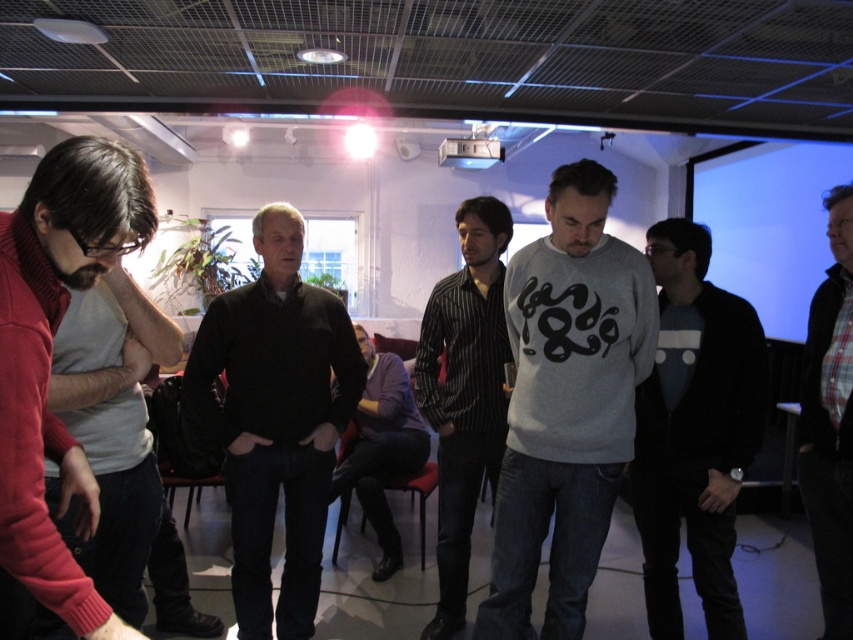
This screenshot has height=640, width=853. Describe the element at coordinates (274, 419) in the screenshot. I see `black matte sweater at center` at that location.

Does black matte sweater at center have a lesser height compared to black striped shirt at center?

Yes.

Is point (311, 496) less distant than point (444, 467)?

That is True.

The width and height of the screenshot is (853, 640). In order to click on black matte sweater at center in this screenshot , I will do pyautogui.click(x=274, y=419).

Is black matte sweater at center smaller than plaid fabric shirt at center?

No.

Is point (212, 342) farther from camera compared to point (802, 477)?

Yes, point (212, 342) is behind point (802, 477).

Does point (263, 605) come farther from viewer compared to point (827, 579)?

Yes, it is.

This screenshot has width=853, height=640. In order to click on black matte sweater at center in this screenshot , I will do `click(274, 419)`.

Is point (230, 492) more distant than point (653, 536)?

No, (230, 492) is closer to viewer.

The width and height of the screenshot is (853, 640). Identify the location of black matte sweater at center. (274, 419).